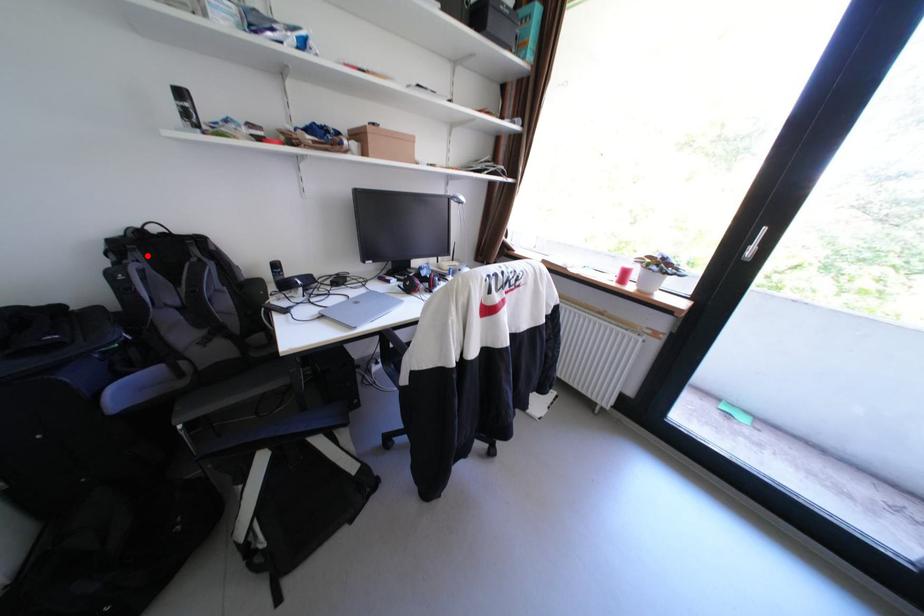
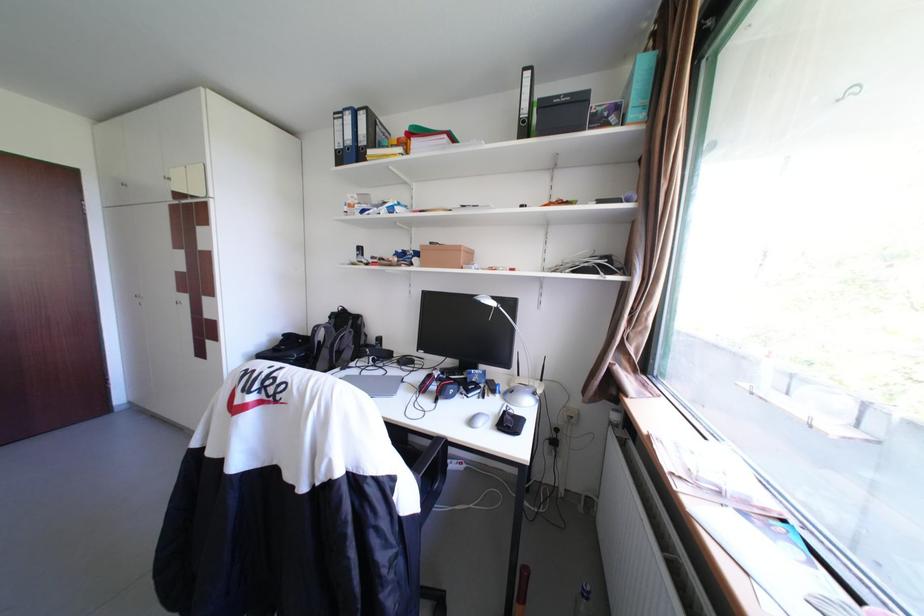
Find the pixel in the second image that matches the highlighted location in the first image.

(344, 321)